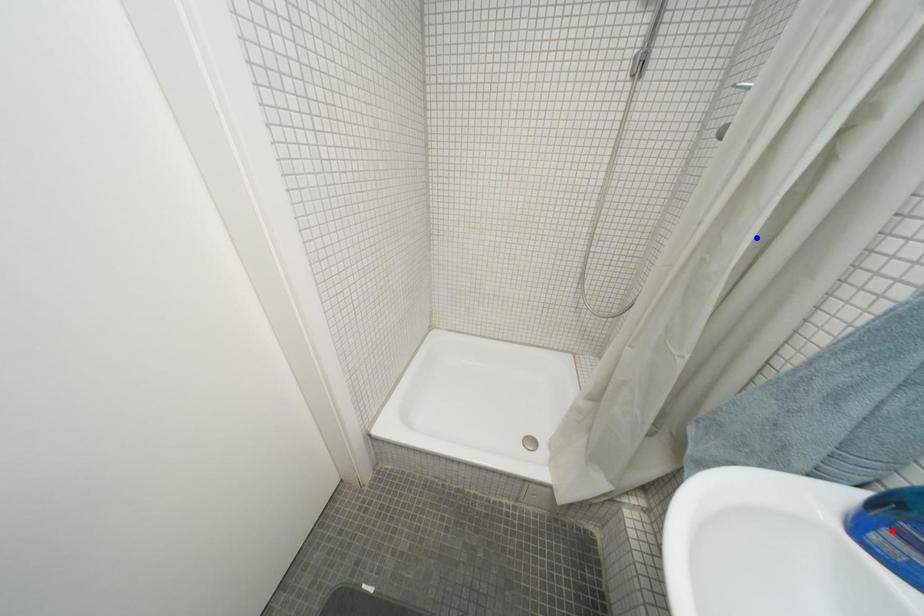
Question: In the image, two points are highlighted. Which point is nearer to the camera? Reply with the corresponding letter.

Choices:
 (A) blue point
 (B) red point

Answer: (B)